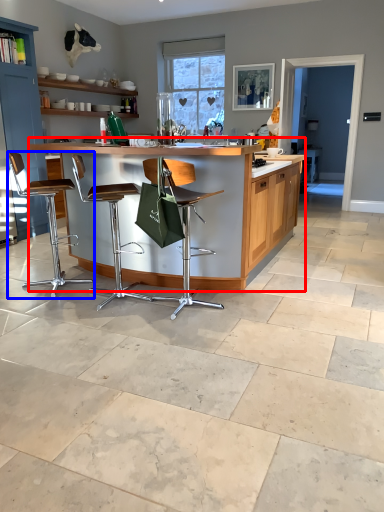
Question: Which object is closer to the camera taking this photo, table (highlighted by a red box) or chair (highlighted by a blue box)?

Choices:
 (A) table
 (B) chair

Answer: (A)